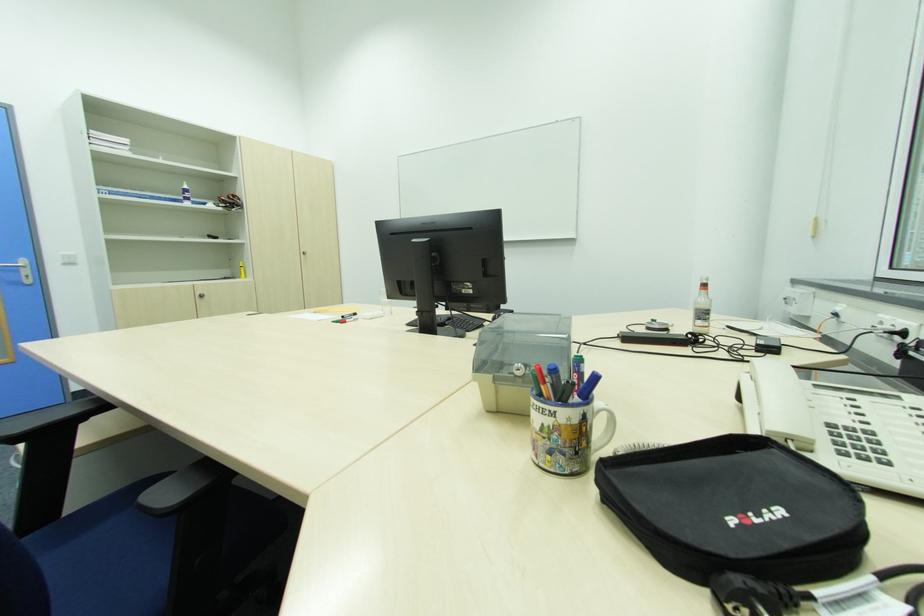
The height and width of the screenshot is (616, 924). What are the coordinates of `silver door handle` in the screenshot? It's located at (11, 265).